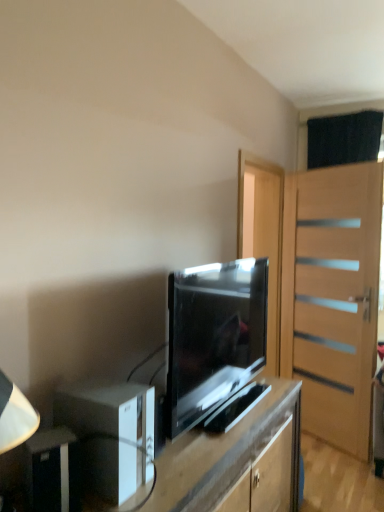
What do you see at coordinates (233, 458) in the screenshot? I see `matte black tv stand at center` at bounding box center [233, 458].

Find the location of a particular element. This screenshot has width=384, height=512. white glossy speaker at lower left, the 1th appliance viewed from the back is located at coordinates (111, 435).

Locate an element on the screen. The height and width of the screenshot is (512, 384). light brown wooden door at right is located at coordinates (332, 298).

From a real-world perspective, which object stands above the other?

matte black tv at center.

Find the location of `desk on the left of matte black tv at center`. desk on the left of matte black tv at center is located at coordinates (233, 458).

From the image's perspective, is matte black tv at center positioned above or below matte black tv stand at center?

matte black tv at center is situated higher than matte black tv stand at center in the image.

Considering the relative positions of matte black tv at center and matte black tv stand at center in the image provided, is matte black tv at center to the right of matte black tv stand at center from the viewer's perspective?

Correct, you'll find matte black tv at center to the right of matte black tv stand at center.

Who is bigger, light brown wooden door at right or black plastic speaker at lower left, the first appliance viewed from the front?

Bigger between the two is light brown wooden door at right.

From the image's perspective, is light brown wooden door at right above black plastic speaker at lower left, the first appliance viewed from the front?

Correct, light brown wooden door at right appears higher than black plastic speaker at lower left, the first appliance viewed from the front, in the image.

Could you tell me if light brown wooden door at right is turned towards black plastic speaker at lower left, arranged as the second appliance when viewed from the back?

Yes, light brown wooden door at right is aimed at black plastic speaker at lower left, arranged as the second appliance when viewed from the back.

Which is in front, light brown wooden door at right or black plastic speaker at lower left, arranged as the second appliance when viewed from the back?

black plastic speaker at lower left, arranged as the second appliance when viewed from the back, is more forward.

Does white glossy speaker at lower left, the 1th appliance viewed from the back, come behind matte black tv stand at center?

Yes, it is behind matte black tv stand at center.

Is point (126, 478) less distant than point (166, 477)?

Yes, it is in front of point (166, 477).

In terms of width, does white glossy speaker at lower left, the 1th appliance viewed from the back, look wider or thinner when compared to matte black tv stand at center?

white glossy speaker at lower left, the 1th appliance viewed from the back, is thinner than matte black tv stand at center.

The image size is (384, 512). Find the location of `the 2nd appliance located above the matte black tv stand at center (from a real-world perspective)`. the 2nd appliance located above the matte black tv stand at center (from a real-world perspective) is located at coordinates (111, 435).

Considering the points (343, 327) and (207, 386), which point is in front, point (343, 327) or point (207, 386)?

The point (207, 386) is closer to the camera.

Is light brown wooden door at right at the right side of matte black tv at center?

Correct, you'll find light brown wooden door at right to the right of matte black tv at center.

Considering the relative sizes of light brown wooden door at right and matte black tv at center in the image provided, is light brown wooden door at right wider than matte black tv at center?

Incorrect, the width of light brown wooden door at right does not surpass that of matte black tv at center.

From a real-world perspective, is light brown wooden door at right located beneath matte black tv at center?

Indeed, from a real-world perspective, light brown wooden door at right is positioned beneath matte black tv at center.

Does matte black tv stand at center have a lesser width compared to light brown wooden door at right?

Incorrect, the width of matte black tv stand at center is not less than that of light brown wooden door at right.

Would you say matte black tv stand at center is outside light brown wooden door at right?

Yes.

Can you confirm if matte black tv stand at center is shorter than light brown wooden door at right?

Yes, matte black tv stand at center is shorter than light brown wooden door at right.

Considering the points (281, 389) and (347, 369), which point is in front, point (281, 389) or point (347, 369)?

The point (281, 389) is more forward.

Is matte black tv at center facing towards white glossy speaker at lower left, the 2th appliance viewed from the front?

No, matte black tv at center does not turn towards white glossy speaker at lower left, the 2th appliance viewed from the front.

From the picture: Measure the distance between matte black tv at center and white glossy speaker at lower left, the 1th appliance viewed from the back.

16.52 inches.

Is point (198, 280) closer or farther from the camera than point (136, 417)?

Point (198, 280) is farther from the camera than point (136, 417).

Is white glossy speaker at lower left, the 1th appliance viewed from the back, a part of matte black tv at center?

No, white glossy speaker at lower left, the 1th appliance viewed from the back, is not a part of matte black tv at center.

Between white glossy speaker at lower left, the 2th appliance viewed from the front, and black plastic speaker at lower left, the first appliance viewed from the front, which one has more height?

white glossy speaker at lower left, the 2th appliance viewed from the front, is taller.

In the scene shown: Measure the distance from white glossy speaker at lower left, the 2th appliance viewed from the front, to black plastic speaker at lower left, arranged as the second appliance when viewed from the back.

white glossy speaker at lower left, the 2th appliance viewed from the front, and black plastic speaker at lower left, arranged as the second appliance when viewed from the back, are 5.51 inches apart.

Would you say black plastic speaker at lower left, the first appliance viewed from the front, is part of white glossy speaker at lower left, the 2th appliance viewed from the front,'s contents?

Actually, black plastic speaker at lower left, the first appliance viewed from the front, is outside white glossy speaker at lower left, the 2th appliance viewed from the front.

Is white glossy speaker at lower left, the 2th appliance viewed from the front, smaller than black plastic speaker at lower left, the first appliance viewed from the front?

Actually, white glossy speaker at lower left, the 2th appliance viewed from the front, might be larger than black plastic speaker at lower left, the first appliance viewed from the front.

This screenshot has width=384, height=512. I want to click on desk below the matte black tv at center (from the image's perspective), so click(233, 458).

The height and width of the screenshot is (512, 384). In the image, there is a black plastic speaker at lower left, the first appliance viewed from the front. In order to click on door above it (from the image's perspective) in this screenshot , I will do `click(332, 298)`.

When comparing their distances from black plastic speaker at lower left, the first appliance viewed from the front, does light brown wooden door at right or matte black tv stand at center seem closer?

matte black tv stand at center.

Estimate the real-world distances between objects in this image. Which object is closer to light brown wooden door at right, black plastic speaker at lower left, arranged as the second appliance when viewed from the back, or matte black tv stand at center?

matte black tv stand at center is positioned closer to the anchor light brown wooden door at right.

From the image, which object appears to be farther from matte black tv stand at center, matte black tv at center or black plastic speaker at lower left, arranged as the second appliance when viewed from the back?

The object further to matte black tv stand at center is black plastic speaker at lower left, arranged as the second appliance when viewed from the back.

Based on their spatial positions, is white glossy speaker at lower left, the 1th appliance viewed from the back, or black plastic speaker at lower left, the first appliance viewed from the front, closer to matte black tv at center?

white glossy speaker at lower left, the 1th appliance viewed from the back, is positioned closer to the anchor matte black tv at center.

When comparing their distances from light brown wooden door at right, does matte black tv stand at center or white glossy speaker at lower left, the 1th appliance viewed from the back, seem closer?

matte black tv stand at center lies closer to light brown wooden door at right than the other object.

Estimate the real-world distances between objects in this image. Which object is further from matte black tv stand at center, black plastic speaker at lower left, the first appliance viewed from the front, or matte black tv at center?

black plastic speaker at lower left, the first appliance viewed from the front, is positioned further to the anchor matte black tv stand at center.

Looking at the image, which one is located closer to white glossy speaker at lower left, the 1th appliance viewed from the back, matte black tv at center or matte black tv stand at center?

Among the two, matte black tv stand at center is located nearer to white glossy speaker at lower left, the 1th appliance viewed from the back.

Based on their spatial positions, is matte black tv at center or white glossy speaker at lower left, the 2th appliance viewed from the front, further from matte black tv stand at center?

Among the two, matte black tv at center is located further to matte black tv stand at center.

Identify the location of appliance between black plastic speaker at lower left, arranged as the second appliance when viewed from the back, and matte black tv at center, in the horizontal direction. This screenshot has height=512, width=384. (111, 435).

The image size is (384, 512). I want to click on television positioned between white glossy speaker at lower left, the 2th appliance viewed from the front, and light brown wooden door at right from near to far, so click(213, 337).

Find the location of a particular element. The height and width of the screenshot is (512, 384). appliance between black plastic speaker at lower left, the first appliance viewed from the front, and light brown wooden door at right, along the z-axis is located at coordinates (111, 435).

Identify the location of appliance that lies between white glossy speaker at lower left, the 2th appliance viewed from the front, and matte black tv stand at center from top to bottom. The height and width of the screenshot is (512, 384). (53, 471).